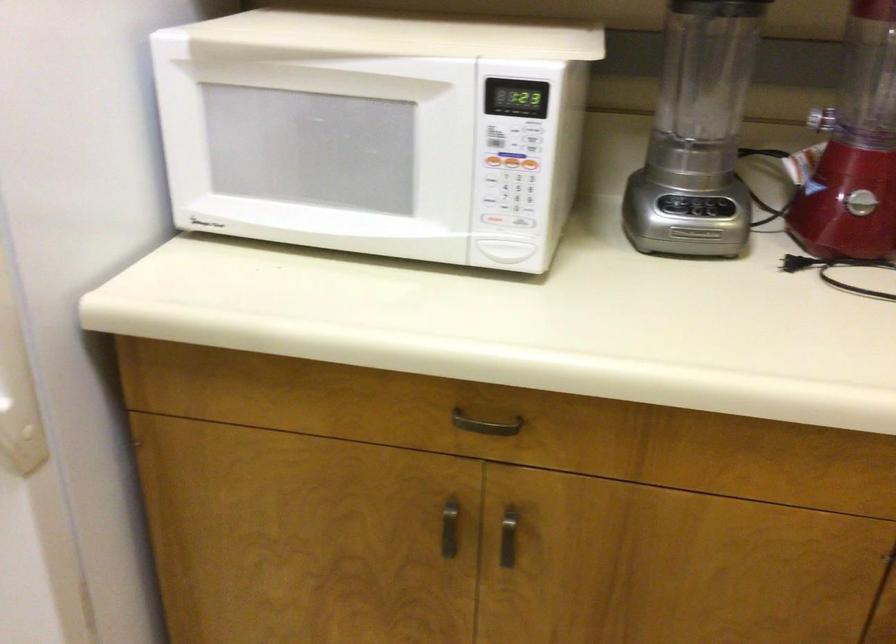
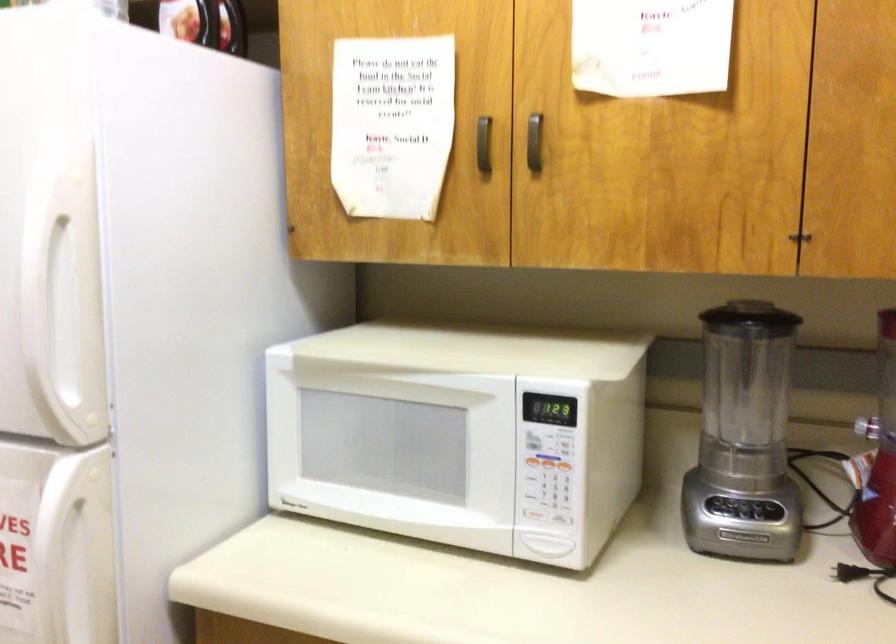
The point at (488,158) is marked in the first image. Where is the corresponding point in the second image?

(530, 462)